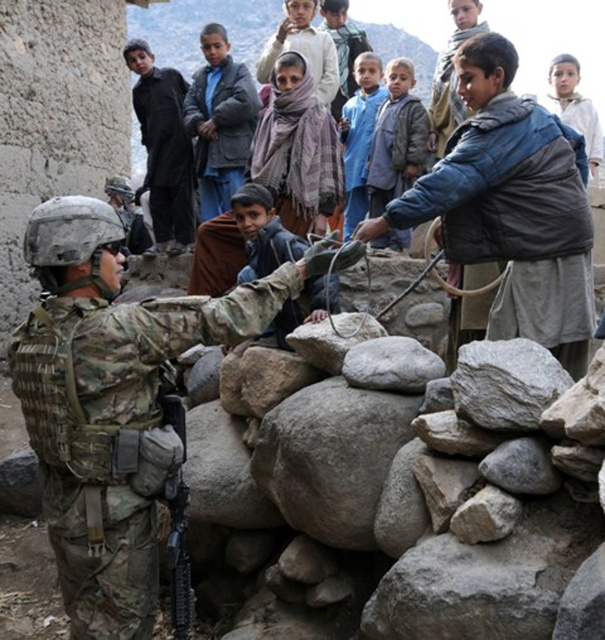
Question: Is the position of blue fuzzy vest at center less distant than that of blue fabric shirt at center?

Choices:
 (A) yes
 (B) no

Answer: (A)

Question: Can you confirm if blue fuzzy vest at center is positioned above blue woolen sweater at center?

Choices:
 (A) no
 (B) yes

Answer: (A)

Question: Which point is closer to the camera?

Choices:
 (A) (344, 122)
 (B) (237, 77)
 (C) (397, 80)
 (D) (159, 189)

Answer: (B)

Question: Which of the following is the closest to the observer?

Choices:
 (A) blue fabric shirt at center
 (B) blue fuzzy vest at center

Answer: (B)

Question: In this image, where is black woolen jacket at upper center located relative to blue fabric shirt at center?

Choices:
 (A) right
 (B) left

Answer: (B)

Question: Which object appears closest to the camera in this image?

Choices:
 (A) blue woolen sweater at upper center
 (B) blue fuzzy vest at center
 (C) blue fabric shirt at center
 (D) blue woolen sweater at center

Answer: (B)